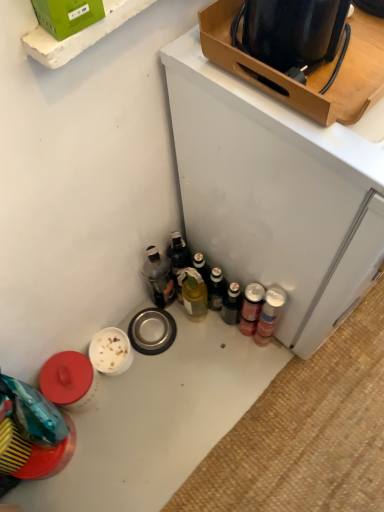
Identify the location of free location to the left of metallic silver can at lower right, which ranks as the 1th bottle in right-to-left order. (212, 355).